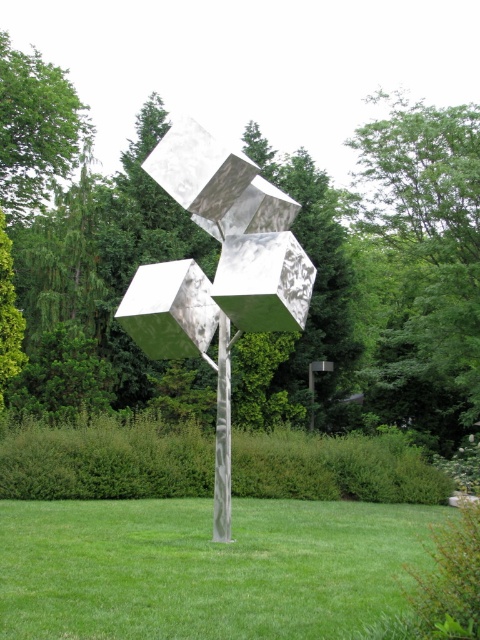
Which is below, green grass at center or green leafy tree at upper left?

green grass at center

Does green grass at center have a greater width compared to green leafy tree at upper left?

No.

What do you see at coordinates (206, 568) in the screenshot? I see `green grass at center` at bounding box center [206, 568].

Locate an element on the screen. The image size is (480, 640). green grass at center is located at coordinates (206, 568).

Does green leafy tree at center appear on the right side of metallic polished pole at center?

No, green leafy tree at center is not to the right of metallic polished pole at center.

Is green leafy tree at center smaller than metallic polished pole at center?

Actually, green leafy tree at center might be larger than metallic polished pole at center.

Between point (475, 104) and point (228, 404), which one is positioned behind?

Point (475, 104)

At what (x,y) coordinates should I click in order to perform the action: click on green leafy tree at center. Please return your answer as a coordinate pair (x, y). Looking at the image, I should click on (292, 230).

Does metallic cubes at center have a greater width compared to green leafy tree at upper left?

In fact, metallic cubes at center might be narrower than green leafy tree at upper left.

Where is `metallic cubes at center`? metallic cubes at center is located at coordinates [218, 273].

The width and height of the screenshot is (480, 640). I want to click on metallic cubes at center, so click(218, 273).